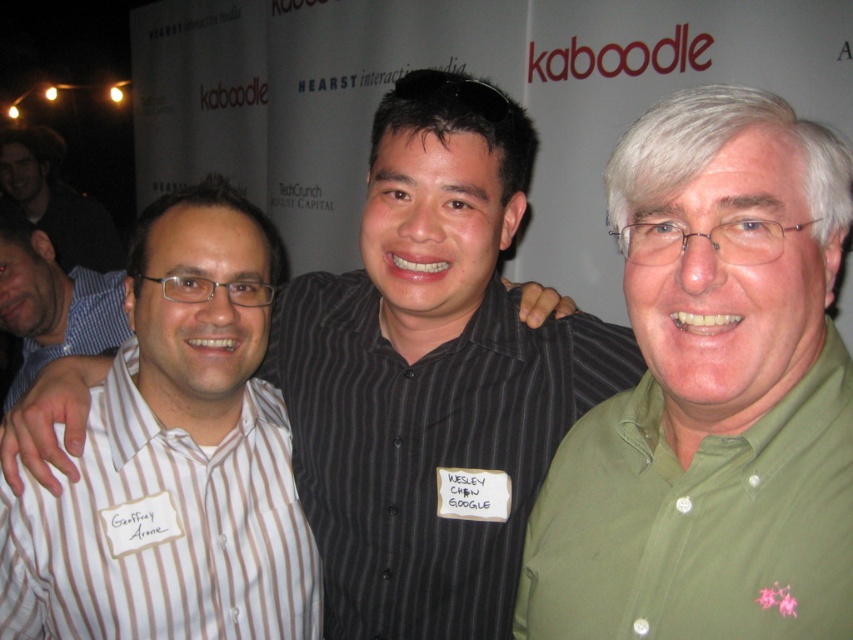
Can you confirm if green cotton shirt at center is positioned to the left of dark brown hair at left?

Incorrect, green cotton shirt at center is not on the left side of dark brown hair at left.

Is green cotton shirt at center below dark brown hair at left?

Correct, green cotton shirt at center is located below dark brown hair at left.

Does point (842, 212) come behind point (65, 220)?

No, it is not.

Where is `green cotton shirt at center`? green cotton shirt at center is located at coordinates (711, 394).

Is green cotton shirt at center above blue striped shirt at left?

No.

Does green cotton shirt at center have a greater height compared to blue striped shirt at left?

Correct, green cotton shirt at center is much taller as blue striped shirt at left.

You are a GUI agent. You are given a task and a screenshot of the screen. Output one action in this format:
    pyautogui.click(x=<x>, y=<y>)
    Task: Click on the green cotton shirt at center
    
    Given the screenshot: What is the action you would take?
    pyautogui.click(x=711, y=394)

Is dark brown hair at left to the right of blue striped shirt at left from the viewer's perspective?

Incorrect, dark brown hair at left is not on the right side of blue striped shirt at left.

Is dark brown hair at left thinner than blue striped shirt at left?

Incorrect, dark brown hair at left's width is not less than blue striped shirt at left's.

Where is `dark brown hair at left`? dark brown hair at left is located at coordinates (55, 200).